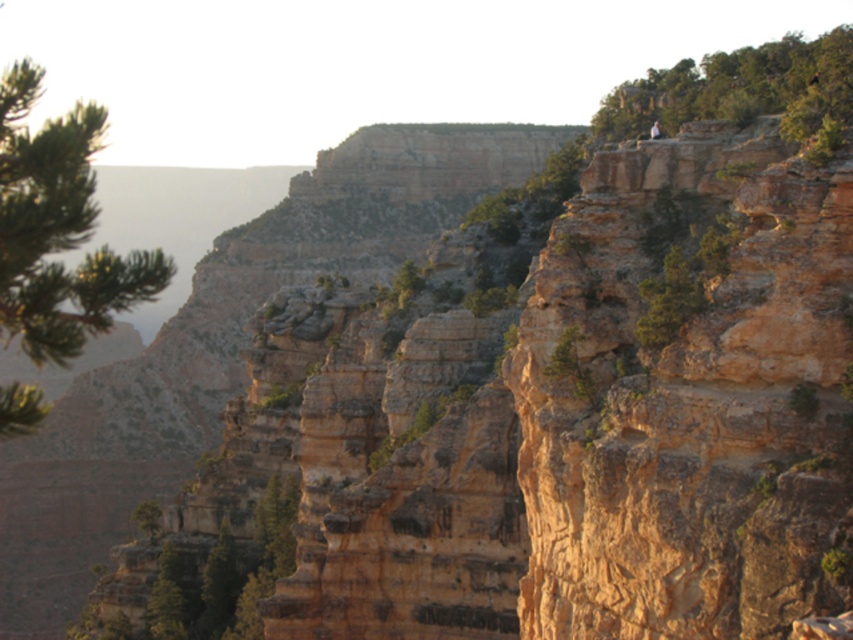
Looking at this image, can you confirm if green textured pine tree at left is positioned above green leafy tree at upper right?

Actually, green textured pine tree at left is below green leafy tree at upper right.

Can you confirm if green textured pine tree at left is wider than green leafy tree at upper right?

Correct, the width of green textured pine tree at left exceeds that of green leafy tree at upper right.

Does point (77, 276) come closer to viewer compared to point (798, 124)?

Yes, it is.

Identify the location of green textured pine tree at left. Image resolution: width=853 pixels, height=640 pixels. (57, 228).